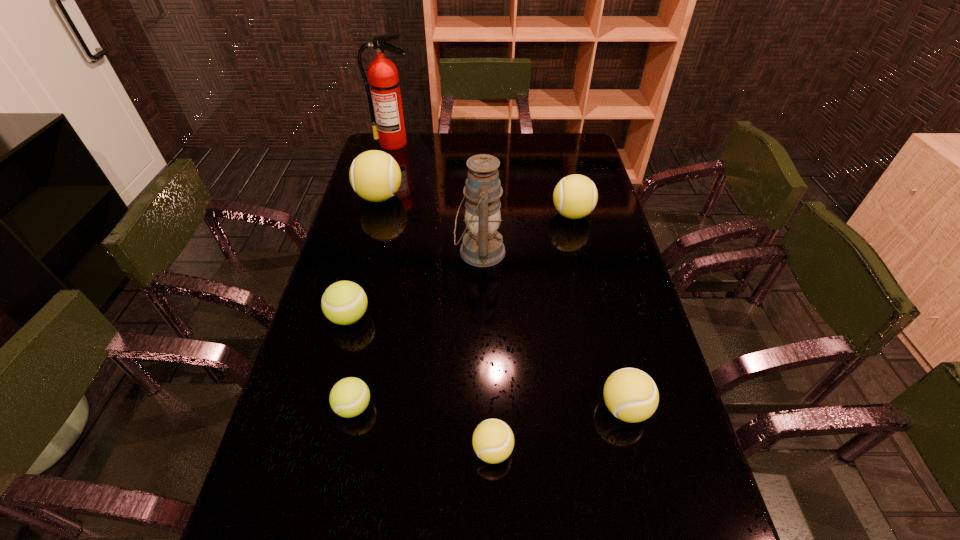
You are a GUI agent. You are given a task and a screenshot of the screen. Output one action in this format:
    pyautogui.click(x=<x>, y=<y>)
    Task: Click on the fire extinguisher
    The image size is (960, 540).
    Given the screenshot: What is the action you would take?
    pyautogui.click(x=384, y=83)

Identify the location of the farthest object. The height and width of the screenshot is (540, 960). (384, 83).

Where is `the second tallest object`? This screenshot has width=960, height=540. the second tallest object is located at coordinates (482, 246).

This screenshot has width=960, height=540. In order to click on oil lamp in this screenshot , I will do click(482, 246).

Find the location of `the tallest tennis ball`. the tallest tennis ball is located at coordinates (375, 176).

Find the location of a particular element. The height and width of the screenshot is (540, 960). the leftmost yellow tennis ball is located at coordinates (375, 176).

Find the location of a particular element. This screenshot has width=960, height=540. the second tallest tennis ball is located at coordinates (575, 196).

Where is `the fifth shortest object`? The image size is (960, 540). the fifth shortest object is located at coordinates (575, 196).

Locate an element on the screen. the third biggest yellow tennis ball is located at coordinates (631, 395).

Locate an element on the screen. This screenshot has width=960, height=540. the bigger green tennis ball is located at coordinates (344, 302).